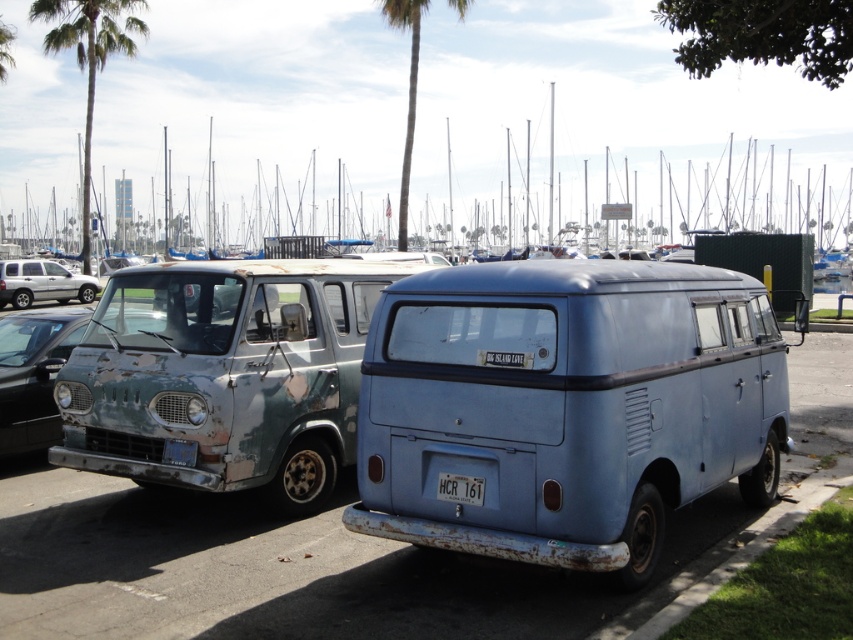
Question: Which is nearer to the silver metallic suv at left?

Choices:
 (A) rusty metal van at center
 (B) green leafy palm tree at upper left

Answer: (B)

Question: In this image, where is rusty metal van at left located relative to green leafy palm tree at center?

Choices:
 (A) right
 (B) left

Answer: (A)

Question: Is silver metallic suv at left positioned at the back of blue matte license plate at front?

Choices:
 (A) no
 (B) yes

Answer: (B)

Question: Which object appears farthest from the camera in this image?

Choices:
 (A) white plastic license plate at rear
 (B) light blue matte van at center
 (C) silver metallic suv at left
 (D) green leafy palm tree at upper left

Answer: (D)

Question: Which point is closer to the camera?

Choices:
 (A) silver metallic suv at left
 (B) rusty metal van at center
 (C) white plastic license plate at rear
 (D) green leafy palm tree at center

Answer: (B)

Question: Can you confirm if light blue matte van at center is thinner than rusty metal van at center?

Choices:
 (A) yes
 (B) no

Answer: (A)